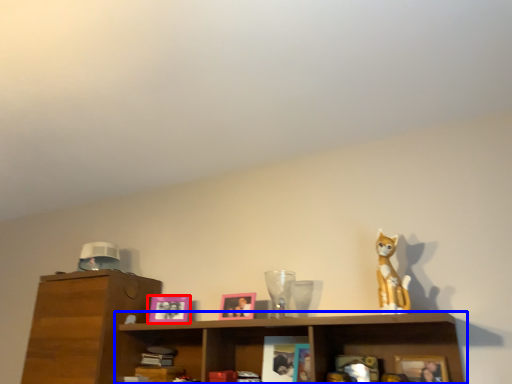
Question: Which object is further to the camera taking this photo, picture frame (highlighted by a red box) or shelf (highlighted by a blue box)?

Choices:
 (A) picture frame
 (B) shelf

Answer: (A)